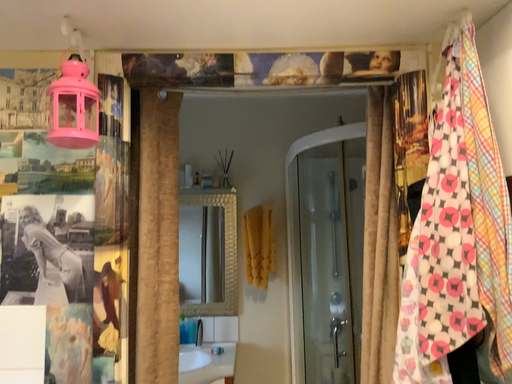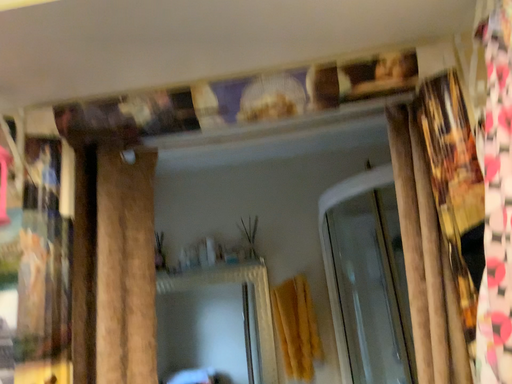
Question: Which way did the camera rotate in the video?

Choices:
 (A) rotated left
 (B) rotated right

Answer: (A)